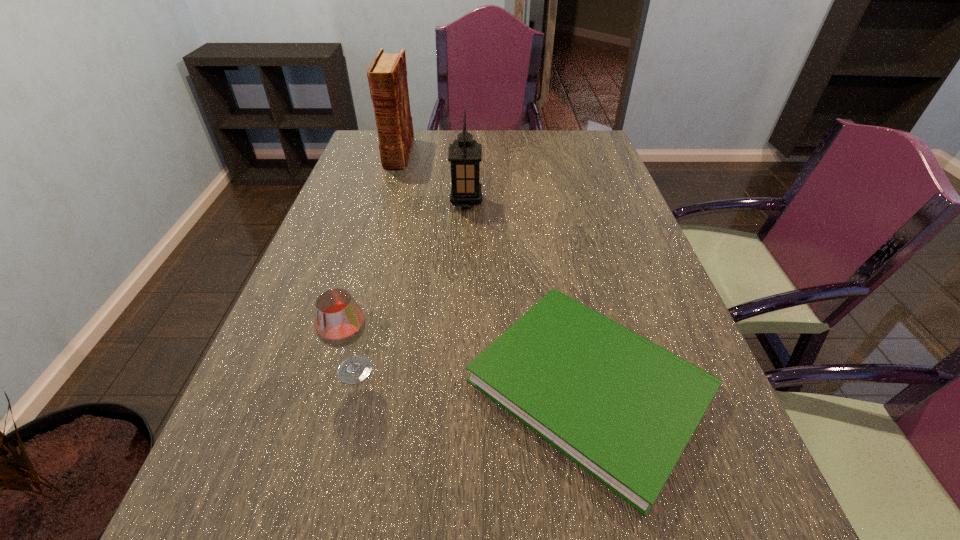
At what (x,y) coordinates should I click in order to perform the action: click on vacant space in between the lantern and the shortest object. Please return your answer as a coordinate pair (x, y). This screenshot has height=540, width=960. Looking at the image, I should click on (528, 294).

Image resolution: width=960 pixels, height=540 pixels. In order to click on vacant region between the wineglass and the farthest object in this screenshot , I will do `click(376, 262)`.

Identify the location of empty space that is in between the third nearest object and the second shortest object. (411, 286).

This screenshot has height=540, width=960. Find the location of `vacant region between the hardback book and the shortest object`. vacant region between the hardback book and the shortest object is located at coordinates tap(494, 270).

At what (x,y) coordinates should I click in order to perform the action: click on empty space between the shortest object and the lantern. Please return your answer as a coordinate pair (x, y). Looking at the image, I should click on (528, 294).

Locate an element on the screen. Image resolution: width=960 pixels, height=540 pixels. vacant region between the lantern and the shortest object is located at coordinates (528, 294).

At what (x,y) coordinates should I click in order to perform the action: click on free space between the wineglass and the lantern. Please return your answer as a coordinate pair (x, y). Looking at the image, I should click on (411, 286).

Where is `the third closest object to the shortest object`? the third closest object to the shortest object is located at coordinates (387, 75).

The height and width of the screenshot is (540, 960). What are the coordinates of `the closest object to the paperback book` in the screenshot? It's located at (339, 322).

Where is `vacant point that satisfies the following two spatial constraints: 1. on the spine side of the farthest object; 2. on the right side of the second farthest object`? vacant point that satisfies the following two spatial constraints: 1. on the spine side of the farthest object; 2. on the right side of the second farthest object is located at coordinates (384, 202).